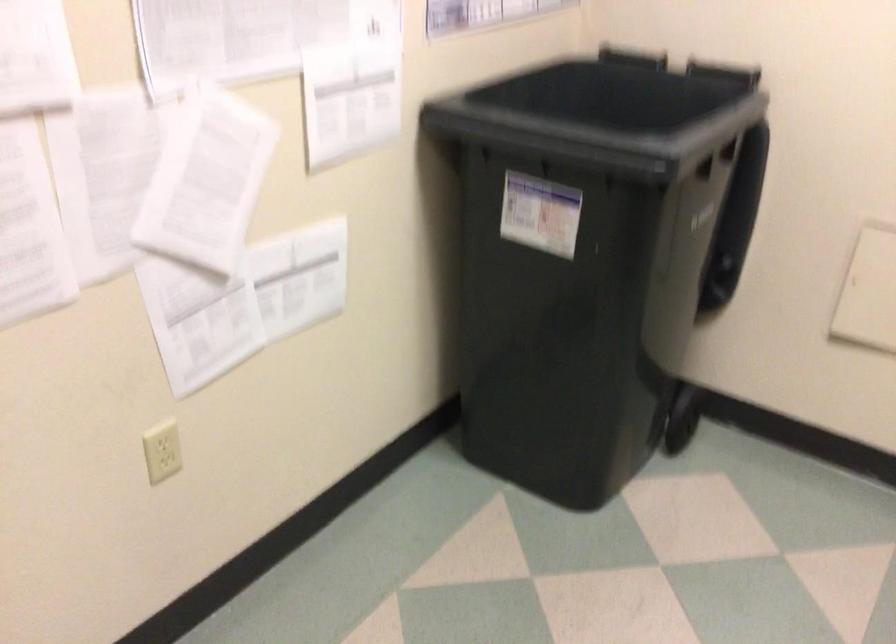
The height and width of the screenshot is (644, 896). What do you see at coordinates (539, 162) in the screenshot? I see `the black bin handle` at bounding box center [539, 162].